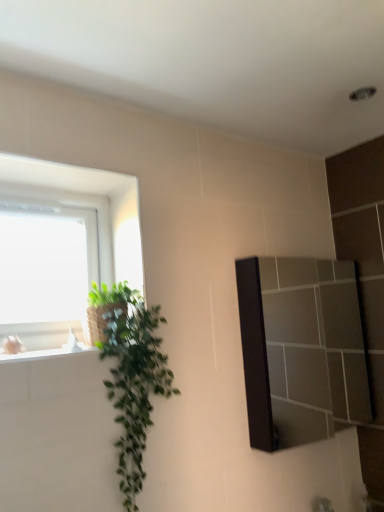
Question: Is matte black mirror at right located outside green leafy plant at left?

Choices:
 (A) yes
 (B) no

Answer: (A)

Question: Is matte black mirror at right taller than green leafy plant at left?

Choices:
 (A) yes
 (B) no

Answer: (B)

Question: Is green leafy plant at left at the back of matte black mirror at right?

Choices:
 (A) no
 (B) yes

Answer: (A)

Question: From a real-world perspective, is matte black mirror at right positioned over green leafy plant at left based on gravity?

Choices:
 (A) no
 (B) yes

Answer: (B)

Question: Can you confirm if matte black mirror at right is thinner than green leafy plant at left?

Choices:
 (A) yes
 (B) no

Answer: (A)

Question: Is matte black mirror at right in front of green leafy plant at left?

Choices:
 (A) yes
 (B) no

Answer: (B)

Question: From the image's perspective, is green leafy plant at left below matte black mirror at right?

Choices:
 (A) no
 (B) yes

Answer: (B)

Question: Does green leafy plant at left have a smaller size compared to matte black mirror at right?

Choices:
 (A) yes
 (B) no

Answer: (B)

Question: Considering the relative sizes of green leafy plant at left and matte black mirror at right in the image provided, is green leafy plant at left shorter than matte black mirror at right?

Choices:
 (A) no
 (B) yes

Answer: (A)

Question: Can you confirm if green leafy plant at left is bigger than matte black mirror at right?

Choices:
 (A) yes
 (B) no

Answer: (A)

Question: Is green leafy plant at left aimed at matte black mirror at right?

Choices:
 (A) no
 (B) yes

Answer: (A)

Question: Is green leafy plant at left in front of matte black mirror at right?

Choices:
 (A) no
 (B) yes

Answer: (B)

Question: From the image's perspective, is green leafy plant at left positioned above or below matte black mirror at right?

Choices:
 (A) below
 (B) above

Answer: (A)